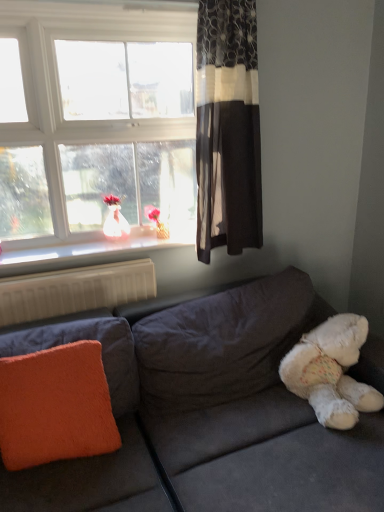
In order to face white glossy doll at window, should I rotate leftwards or rightwards?

You should rotate left by 10.222 degrees.

Image resolution: width=384 pixels, height=512 pixels. Describe the element at coordinates (87, 253) in the screenshot. I see `white glossy window sill at upper left` at that location.

Describe the element at coordinates (75, 290) in the screenshot. The width and height of the screenshot is (384, 512). I see `white plastic radiator at lower left` at that location.

What do you see at coordinates (228, 128) in the screenshot? The width and height of the screenshot is (384, 512). I see `dark floral-patterned curtain at upper right` at bounding box center [228, 128].

Where is `dark floral-patterned curtain at upper right`? dark floral-patterned curtain at upper right is located at coordinates (228, 128).

At what (x,y) coordinates should I click in order to perform the action: click on orange fuzzy pillow at lower left. Please return your answer as a coordinate pair (x, y). The width and height of the screenshot is (384, 512). Looking at the image, I should click on (55, 406).

Between white plastic radiator at lower left and clear glass window at upper left, which one has smaller size?

white plastic radiator at lower left.

Considering the sizes of white plastic radiator at lower left and clear glass window at upper left in the image, is white plastic radiator at lower left wider or thinner than clear glass window at upper left?

white plastic radiator at lower left is thinner than clear glass window at upper left.

Between white plastic radiator at lower left and clear glass window at upper left, which one appears on the left side from the viewer's perspective?

Positioned to the left is white plastic radiator at lower left.

Between point (49, 282) and point (26, 190), which one is positioned behind?

The point (26, 190) is farther.

Is white fluffy teddy bear at lower right to the right of white glossy window sill at upper left from the viewer's perspective?

Yes, white fluffy teddy bear at lower right is to the right of white glossy window sill at upper left.

Is the position of white fluffy teddy bear at lower right more distant than that of white glossy window sill at upper left?

That is False.

Locate an element on the screen. The width and height of the screenshot is (384, 512). window sill above the white fluffy teddy bear at lower right (from a real-world perspective) is located at coordinates (87, 253).

What's the angular difference between white fluffy teddy bear at lower right and white glossy window sill at upper left's facing directions?

1.17 degrees separate the facing orientations of white fluffy teddy bear at lower right and white glossy window sill at upper left.

From the image's perspective, between white glossy doll at window and orange fuzzy pillow at lower left, who is located below?

orange fuzzy pillow at lower left, from the image's perspective.

In order to click on doll lying on the right of orange fuzzy pillow at lower left in this screenshot , I will do `click(114, 219)`.

Based on the photo, from a real-world perspective, which is physically above, white glossy doll at window or orange fuzzy pillow at lower left?

white glossy doll at window is physically above.

Between white glossy doll at window and white plastic radiator at lower left, which one has smaller width?

Thinner between the two is white glossy doll at window.

Could you tell me if white glossy doll at window is facing white plastic radiator at lower left?

No, white glossy doll at window does not turn towards white plastic radiator at lower left.

Is white glossy doll at window taller or shorter than white plastic radiator at lower left?

Considering their sizes, white glossy doll at window has less height than white plastic radiator at lower left.

Which object is closer to the camera, white glossy doll at window or white plastic radiator at lower left?

Positioned in front is white plastic radiator at lower left.

Who is shorter, orange fuzzy pillow at lower left or white plastic radiator at lower left?

With less height is white plastic radiator at lower left.

From a real-world perspective, which object rests below the other?

From a 3D spatial view, orange fuzzy pillow at lower left is below.

Is orange fuzzy pillow at lower left outside of white plastic radiator at lower left?

Absolutely, orange fuzzy pillow at lower left is external to white plastic radiator at lower left.

Considering the positions of objects orange fuzzy pillow at lower left and white plastic radiator at lower left in the image provided, who is behind, orange fuzzy pillow at lower left or white plastic radiator at lower left?

white plastic radiator at lower left.

Considering the positions of point (145, 243) and point (143, 275), is point (145, 243) closer or farther from the camera than point (143, 275)?

Point (145, 243).

Is white glossy window sill at upper left to the right of white plastic radiator at lower left from the viewer's perspective?

Yes.

From a real-world perspective, which object rests below the other?

From a 3D spatial view, white plastic radiator at lower left is below.

From the image's perspective, is white glossy window sill at upper left above or below white plastic radiator at lower left?

From the image's perspective, white glossy window sill at upper left appears above white plastic radiator at lower left.

From the image's perspective, would you say dark floral-patterned curtain at upper right is positioned over velvet gray couch at lower right?

Yes.

How many degrees apart are the facing directions of dark floral-patterned curtain at upper right and velvet gray couch at lower right?

87.8 degrees separate the facing orientations of dark floral-patterned curtain at upper right and velvet gray couch at lower right.

Is there a large distance between dark floral-patterned curtain at upper right and velvet gray couch at lower right?

They are positioned close to each other.

Which point is more forward, (234, 147) or (258, 486)?

The point (258, 486) is more forward.

The height and width of the screenshot is (512, 384). Identify the location of radiator behind the clear glass window at upper left. (75, 290).

Find the location of a particular element. teddy bear below the white glossy window sill at upper left (from the image's perspective) is located at coordinates (331, 371).

Looking at this image, which object lies nearer to the anchor point orange fuzzy pillow at lower left, white fluffy teddy bear at lower right or white glossy window sill at upper left?

white glossy window sill at upper left is positioned closer to the anchor orange fuzzy pillow at lower left.

Considering their positions, is white glossy doll at window positioned further to orange fuzzy pillow at lower left than white glossy window sill at upper left?

white glossy doll at window lies further to orange fuzzy pillow at lower left than the other object.

Looking at the image, which one is located further to white glossy doll at window, dark floral-patterned curtain at upper right or clear glass window at upper left?

dark floral-patterned curtain at upper right.

Which object lies further to the anchor point dark floral-patterned curtain at upper right, velvet gray couch at lower right or white fluffy teddy bear at lower right?

The object further to dark floral-patterned curtain at upper right is white fluffy teddy bear at lower right.

When comparing their distances from dark floral-patterned curtain at upper right, does white glossy doll at window or white fluffy teddy bear at lower right seem further?

white fluffy teddy bear at lower right is positioned further to the anchor dark floral-patterned curtain at upper right.

Estimate the real-world distances between objects in this image. Which object is closer to dark floral-patterned curtain at upper right, white fluffy teddy bear at lower right or clear glass window at upper left?

Based on the image, clear glass window at upper left appears to be nearer to dark floral-patterned curtain at upper right.

Looking at the image, which one is located closer to dark floral-patterned curtain at upper right, orange fuzzy pillow at lower left or white fluffy teddy bear at lower right?

white fluffy teddy bear at lower right.

Based on their spatial positions, is orange fuzzy pillow at lower left or white glossy window sill at upper left further from white fluffy teddy bear at lower right?

white glossy window sill at upper left is further to white fluffy teddy bear at lower right.

This screenshot has height=512, width=384. In order to click on doll between clear glass window at upper left and white fluffy teddy bear at lower right from left to right in this screenshot , I will do `click(114, 219)`.

Locate an element on the screen. This screenshot has width=384, height=512. pillow between dark floral-patterned curtain at upper right and velvet gray couch at lower right in the up-down direction is located at coordinates (55, 406).

At what (x,y) coordinates should I click in order to perform the action: click on doll between orange fuzzy pillow at lower left and white fluffy teddy bear at lower right from left to right. Please return your answer as a coordinate pair (x, y). Image resolution: width=384 pixels, height=512 pixels. Looking at the image, I should click on (114, 219).

Image resolution: width=384 pixels, height=512 pixels. I want to click on radiator that lies between dark floral-patterned curtain at upper right and orange fuzzy pillow at lower left from top to bottom, so click(x=75, y=290).